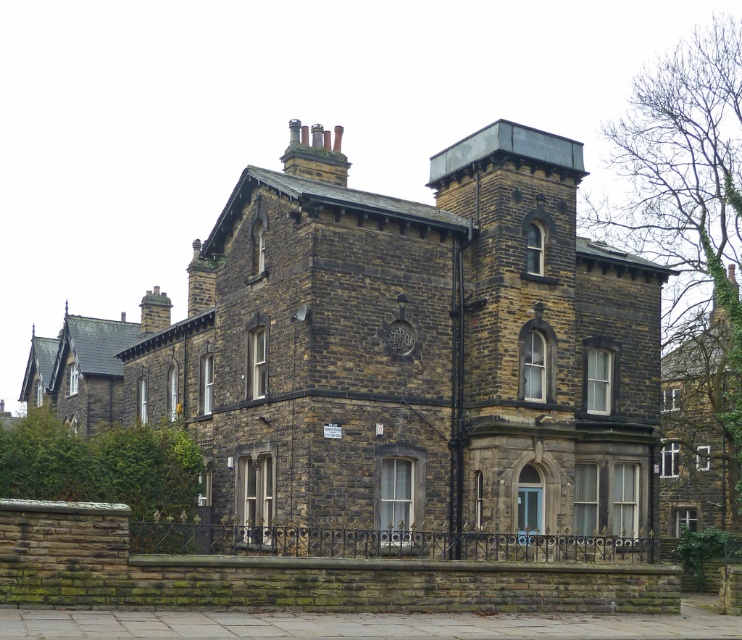
Question: From the image, what is the correct spatial relationship of dark brown stone chimney at upper left in relation to green ivy-covered chimney at upper right?

Choices:
 (A) below
 (B) above

Answer: (B)

Question: Which object is the closest to the green ivy-covered chimney at upper right?

Choices:
 (A) dark gray stone chimney at upper center
 (B) brown stone chimney at upper center
 (C) dark brown stone chimney at upper left

Answer: (A)

Question: Observing the image, what is the correct spatial positioning of dark gray stone chimney at upper center in reference to brown stone chimney at upper center?

Choices:
 (A) above
 (B) below

Answer: (A)

Question: Which point appears closest to the camera in this image?

Choices:
 (A) (312, 170)
 (B) (715, 307)

Answer: (A)

Question: Does dark gray stone chimney at upper center appear under dark brown stone chimney at upper left?

Choices:
 (A) yes
 (B) no

Answer: (B)

Question: Which of the following is the closest to the observer?

Choices:
 (A) (160, 291)
 (B) (732, 278)
 (C) (298, 163)
 (D) (213, 301)

Answer: (C)